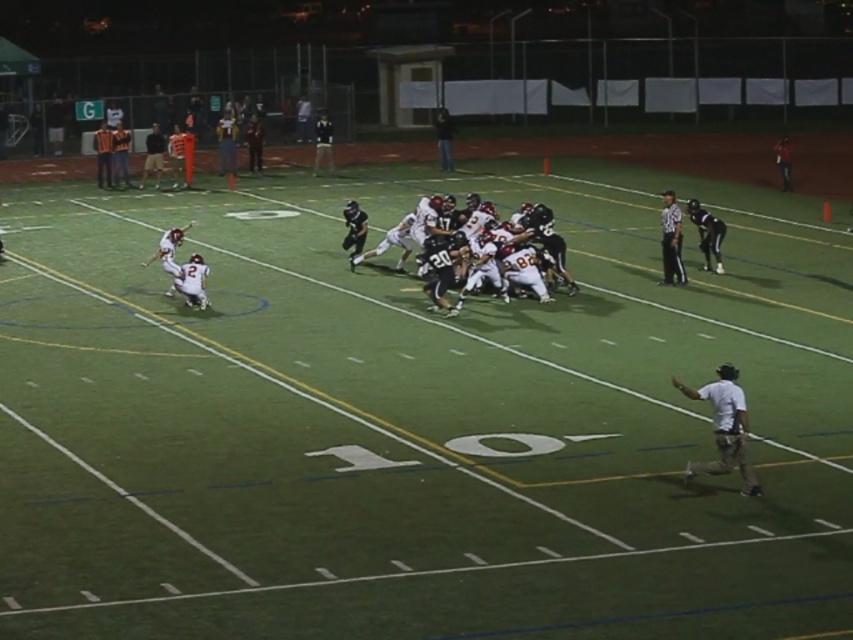
Question: Considering the relative positions of white matte football players at center and white cotton shirt at lower right in the image provided, where is white matte football players at center located with respect to white cotton shirt at lower right?

Choices:
 (A) right
 (B) left

Answer: (B)

Question: Does white matte football players at center have a lesser width compared to white cotton shirt at lower right?

Choices:
 (A) yes
 (B) no

Answer: (B)

Question: Can you confirm if white matte football players at center is positioned to the right of white cotton shirt at lower right?

Choices:
 (A) no
 (B) yes

Answer: (A)